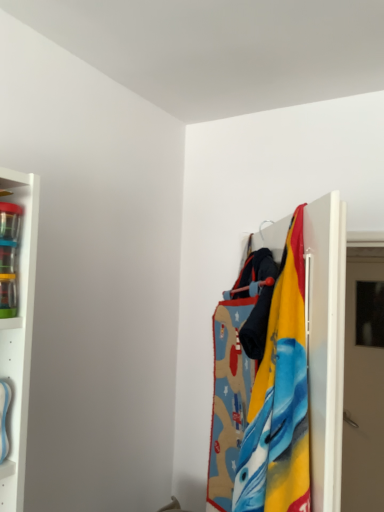
Describe the element at coordinates (326, 344) in the screenshot. I see `textured fabric at right` at that location.

This screenshot has width=384, height=512. I want to click on textured fabric at right, so click(x=326, y=344).

Where is `beige matte door at right`? The width and height of the screenshot is (384, 512). beige matte door at right is located at coordinates (363, 388).

Image resolution: width=384 pixels, height=512 pixels. Describe the element at coordinates (363, 388) in the screenshot. I see `beige matte door at right` at that location.

The width and height of the screenshot is (384, 512). Find the location of `textured fabric at right`. textured fabric at right is located at coordinates (326, 344).

Can you confirm if textured fabric at right is positioned to the right of beige matte door at right?

Incorrect, textured fabric at right is not on the right side of beige matte door at right.

In the scene shown: Which object is closer to the camera taking this photo, textured fabric at right or beige matte door at right?

textured fabric at right is closer to the camera.

Based on the photo, which is nearer, (328, 314) or (359, 295)?

The point (328, 314) is more forward.

From the image's perspective, does textured fabric at right appear lower than beige matte door at right?

Incorrect, from the image's perspective, textured fabric at right is higher than beige matte door at right.

From a real-world perspective, is textured fabric at right positioned over beige matte door at right based on gravity?

Indeed, from a real-world perspective, textured fabric at right stands above beige matte door at right.

Which of these two, textured fabric at right or beige matte door at right, is thinner?

With smaller width is beige matte door at right.

Looking at this image, does textured fabric at right have a greater height compared to beige matte door at right?

Incorrect, the height of textured fabric at right is not larger of that of beige matte door at right.

Based on the photo, can you confirm if textured fabric at right is smaller than beige matte door at right?

No.

Is textured fabric at right inside the boundaries of beige matte door at right, or outside?

textured fabric at right lies outside beige matte door at right.

Is textured fabric at right positioned far away from beige matte door at right?

textured fabric at right is positioned a significant distance from beige matte door at right.

Is textured fabric at right aimed at beige matte door at right?

No, textured fabric at right is not aimed at beige matte door at right.

Consider the image. Can you tell me how much textured fabric at right and beige matte door at right differ in facing direction?

textured fabric at right and beige matte door at right are facing 56.4 degrees away from each other.

Locate an element on the screen. closet located in front of the beige matte door at right is located at coordinates (326, 344).

Can you confirm if beige matte door at right is positioned to the right of textured fabric at right?

Yes.

Consider the image. Which object is more forward, beige matte door at right or textured fabric at right?

textured fabric at right is closer to the camera.

Which is closer to the camera, (x=363, y=413) or (x=271, y=232)?

Point (x=363, y=413).

From the image's perspective, is beige matte door at right located above textured fabric at right?

Actually, beige matte door at right appears below textured fabric at right in the image.

From a real-world perspective, between beige matte door at right and textured fabric at right, who is vertically lower?

beige matte door at right, from a real-world perspective.

Is beige matte door at right wider than textured fabric at right?

In fact, beige matte door at right might be narrower than textured fabric at right.

Does beige matte door at right have a greater height compared to textured fabric at right?

Yes, beige matte door at right is taller than textured fabric at right.

Does beige matte door at right have a smaller size compared to textured fabric at right?

Indeed, beige matte door at right has a smaller size compared to textured fabric at right.

Can we say beige matte door at right lies outside textured fabric at right?

Yes.

Would you consider beige matte door at right to be distant from textured fabric at right?

Yes, beige matte door at right and textured fabric at right are located far from each other.

Could you tell me if beige matte door at right is turned towards textured fabric at right?

Yes, beige matte door at right is aimed at textured fabric at right.

Consider the image. What's the angular difference between beige matte door at right and textured fabric at right's facing directions?

56.4 degrees separate the facing orientations of beige matte door at right and textured fabric at right.

In order to click on closet that is above the beige matte door at right (from a real-world perspective) in this screenshot , I will do `click(326, 344)`.

This screenshot has width=384, height=512. Identify the location of door on the right of textured fabric at right. (363, 388).

Locate an element on the screen. door below the textured fabric at right (from the image's perspective) is located at coordinates (363, 388).